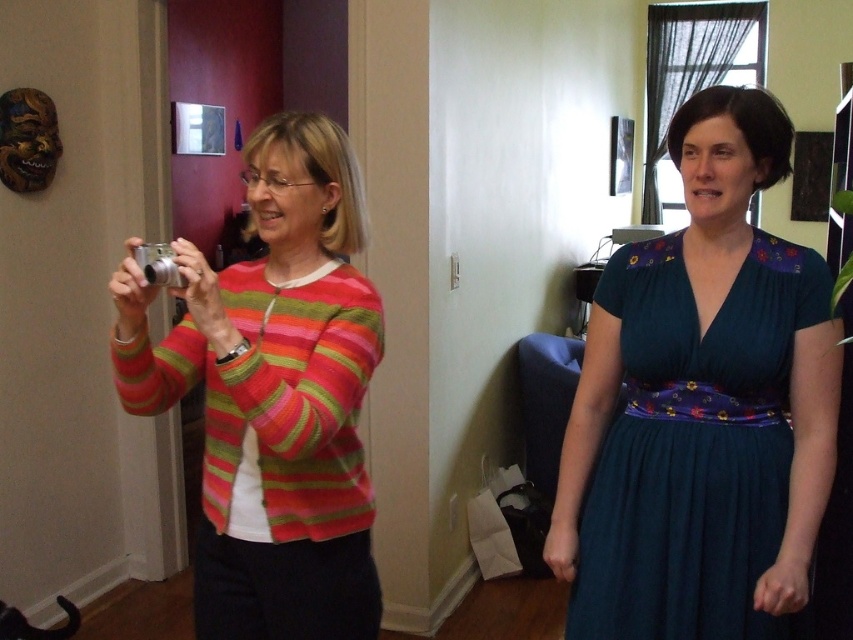
What is the exact coordinate of the dark blue satin dress at center?

The dark blue satin dress at center is located at point (694, 445).

You are standing in front of the two people in the image. You want to place a sticker on the point that is closer to you. Which point should you choose between point (352, 292) and point (148, 256)?

You should choose point (148, 256) because it is closer to you than point (352, 292), which is further away.